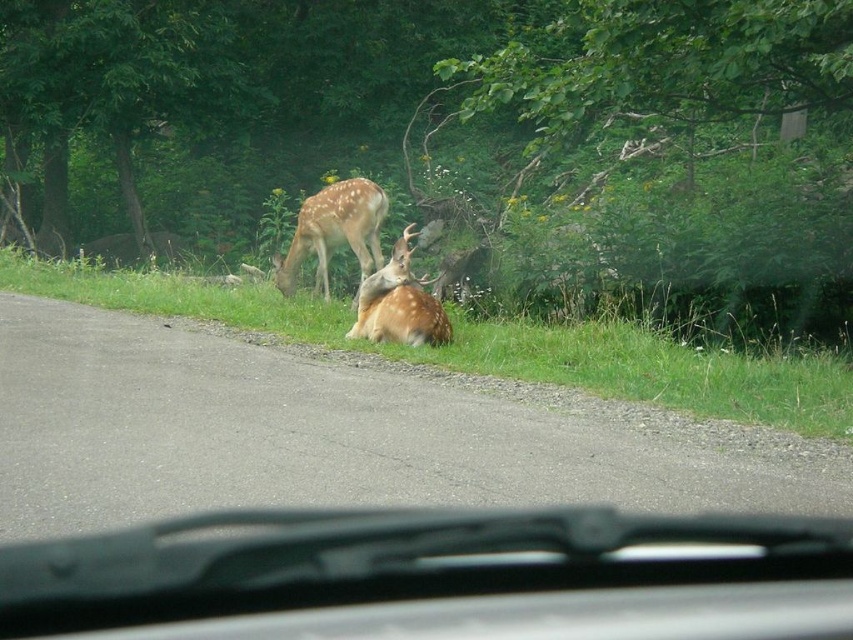
Question: Which of the following is the farthest from the observer?

Choices:
 (A) (234, 604)
 (B) (302, 212)
 (C) (405, 246)
 (D) (535, 339)

Answer: (B)

Question: Does transparent rubber windshield wiper at lower center lie in front of fawn fur antlers at center?

Choices:
 (A) yes
 (B) no

Answer: (A)

Question: Which of the following is the closest to the observer?

Choices:
 (A) fawn fur antlers at center
 (B) spotted fur deer at center
 (C) transparent rubber windshield wiper at lower center

Answer: (C)

Question: From the image, what is the correct spatial relationship of transparent rubber windshield wiper at lower center in relation to fawn fur antlers at center?

Choices:
 (A) below
 (B) above

Answer: (A)

Question: Which point appears closest to the camera in this image?

Choices:
 (A) (328, 256)
 (B) (384, 330)

Answer: (B)

Question: Is green grass at lower center positioned at the back of fawn fur antlers at center?

Choices:
 (A) no
 (B) yes

Answer: (A)